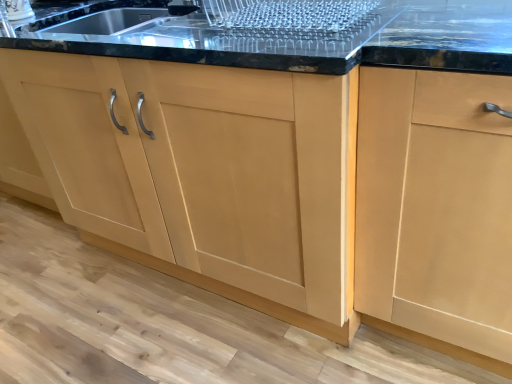
Question: In the image, is matte wood cabinet at right, which ranks as the 2th cabinetry in left-to-right order, positioned in front of or behind light wood cabinet at center, which appears as the second cabinetry when viewed from the right?

Choices:
 (A) front
 (B) behind

Answer: (A)

Question: From the image's perspective, is matte wood cabinet at right, which is the first cabinetry from right to left, located above or below light wood cabinet at center, which appears as the second cabinetry when viewed from the right?

Choices:
 (A) above
 (B) below

Answer: (B)

Question: Does point (458, 226) appear closer or farther from the camera than point (336, 327)?

Choices:
 (A) closer
 (B) farther

Answer: (A)

Question: From a real-world perspective, relative to matte wood cabinet at right, which is the first cabinetry from right to left, is light wood cabinet at center, acting as the 1th cabinetry starting from the left, vertically above or below?

Choices:
 (A) below
 (B) above

Answer: (B)

Question: Is light wood cabinet at center, acting as the 1th cabinetry starting from the left, bigger or smaller than matte wood cabinet at right, which is the first cabinetry from right to left?

Choices:
 (A) big
 (B) small

Answer: (A)

Question: Is point (175, 145) positioned closer to the camera than point (412, 258)?

Choices:
 (A) closer
 (B) farther

Answer: (B)

Question: Relative to matte wood cabinet at right, which is the first cabinetry from right to left, is light wood cabinet at center, which appears as the second cabinetry when viewed from the right, in front or behind?

Choices:
 (A) behind
 (B) front

Answer: (A)